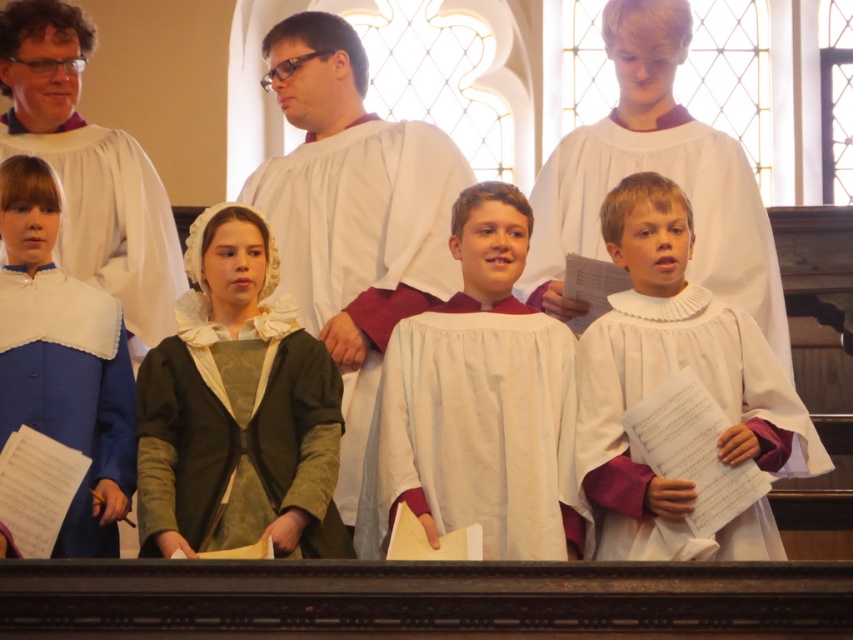
Question: Which object is positioned closest to the blue satin robe at lower left?

Choices:
 (A) white matte choir robe at center
 (B) white pleated robe at center
 (C) green textured fabric robe at center

Answer: (C)

Question: Considering the relative positions of white pleated robe at center and blue satin robe at left in the image provided, where is white pleated robe at center located with respect to blue satin robe at left?

Choices:
 (A) below
 (B) above

Answer: (A)

Question: Considering the relative positions of blue satin robe at left and blue satin robe at lower left in the image provided, where is blue satin robe at left located with respect to blue satin robe at lower left?

Choices:
 (A) left
 (B) right

Answer: (B)

Question: Which object is positioned closest to the white matte choir robe at center?

Choices:
 (A) white pleated robe at center
 (B) blue satin robe at lower left

Answer: (A)

Question: Considering the real-world distances, which object is closest to the white pleated robe at center?

Choices:
 (A) blue satin robe at lower left
 (B) blue satin robe at left
 (C) green suede robe at center

Answer: (C)

Question: Is white pleated robe at center below blue satin robe at left?

Choices:
 (A) yes
 (B) no

Answer: (A)